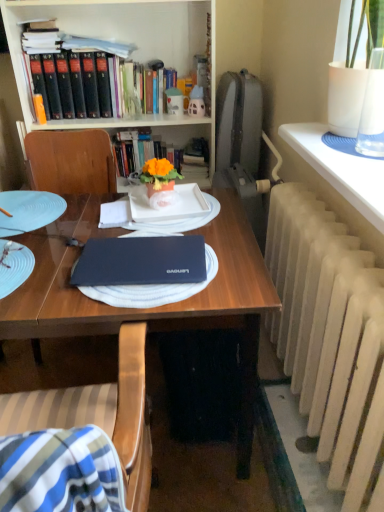
Question: Is white textured radiator at right, which ranks as the second table in back-to-front order, to the right of blue matte glass plate at left from the viewer's perspective?

Choices:
 (A) no
 (B) yes

Answer: (B)

Question: Can you confirm if white textured radiator at right, the 1th table when ordered from right to left, is positioned to the left of blue matte glass plate at left?

Choices:
 (A) yes
 (B) no

Answer: (B)

Question: Is white textured radiator at right, the 1th table positioned from the front, thinner than blue matte glass plate at left?

Choices:
 (A) no
 (B) yes

Answer: (B)

Question: Can you confirm if white textured radiator at right, the 1th table positioned from the front, is wider than blue matte glass plate at left?

Choices:
 (A) yes
 (B) no

Answer: (B)

Question: From the image's perspective, does white textured radiator at right, which is counted as the 2th table, starting from the left, appear higher than blue matte glass plate at left?

Choices:
 (A) no
 (B) yes

Answer: (B)

Question: Is blue matte glass plate at left at the back of white textured radiator at right, which is counted as the 2th table, starting from the left?

Choices:
 (A) yes
 (B) no

Answer: (B)

Question: Is blue matte glass plate at left looking in the opposite direction of wooden chair at center?

Choices:
 (A) yes
 (B) no

Answer: (B)

Question: Does blue matte glass plate at left appear on the left side of wooden chair at center?

Choices:
 (A) yes
 (B) no

Answer: (A)

Question: Does blue matte glass plate at left contain wooden chair at center?

Choices:
 (A) no
 (B) yes

Answer: (A)

Question: From the image's perspective, is blue matte glass plate at left located above wooden chair at center?

Choices:
 (A) no
 (B) yes

Answer: (B)

Question: Is blue matte glass plate at left with wooden chair at center?

Choices:
 (A) yes
 (B) no

Answer: (B)

Question: Is blue matte glass plate at left smaller than wooden chair at center?

Choices:
 (A) no
 (B) yes

Answer: (B)

Question: From the image's perspective, does orange matte flower pot at center appear lower than white painted radiator at right?

Choices:
 (A) no
 (B) yes

Answer: (A)